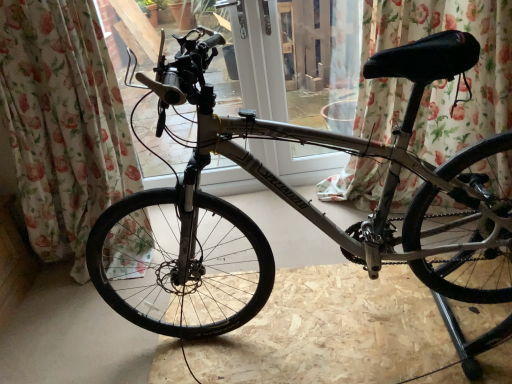
Describe the element at coordinates (456, 77) in the screenshot. I see `floral fabric curtain at upper center, which appears as the 1th curtain when viewed from the right` at that location.

Where is `floral fabric curtain at upper center, which appears as the 1th curtain when viewed from the right`? floral fabric curtain at upper center, which appears as the 1th curtain when viewed from the right is located at coordinates coord(456,77).

Locate an element on the screen. Image resolution: width=512 pixels, height=384 pixels. floral fabric curtain at upper center, which appears as the 1th curtain when viewed from the right is located at coordinates (456, 77).

Between silver metallic bicycle at center and floral fabric curtain at upper center, which appears as the 1th curtain when viewed from the right, which one is positioned in front?

silver metallic bicycle at center is closer to the camera.

Which is nearer, [432,181] or [372,202]?

Point [432,181] is closer to the camera than point [372,202].

Considering the relative sizes of silver metallic bicycle at center and floral fabric curtain at upper center, which appears as the 1th curtain when viewed from the right, in the image provided, is silver metallic bicycle at center taller than floral fabric curtain at upper center, which appears as the 1th curtain when viewed from the right,?

Yes.

Is silver metallic bicycle at center positioned with its back to floral fabric curtain at upper center, the 2th curtain in the left-to-right sequence?

No, silver metallic bicycle at center is not facing away from floral fabric curtain at upper center, the 2th curtain in the left-to-right sequence.

Does point (269, 281) appear closer or farther from the camera than point (94, 25)?

Point (269, 281) appears to be closer to the viewer than point (94, 25).

What's the angular difference between silver metallic bicycle at center and floral fabric curtain at left, positioned as the second curtain in right-to-left order,'s facing directions?

89.9 degrees.

Can floral fabric curtain at left, positioned as the second curtain in right-to-left order, be found inside silver metallic bicycle at center?

Actually, floral fabric curtain at left, positioned as the second curtain in right-to-left order, is outside silver metallic bicycle at center.

Looking at the image, does floral fabric curtain at upper center, the 2th curtain in the left-to-right sequence, seem bigger or smaller compared to floral fabric curtain at left, positioned as the second curtain in right-to-left order?

Considering their sizes, floral fabric curtain at upper center, the 2th curtain in the left-to-right sequence, takes up less space than floral fabric curtain at left, positioned as the second curtain in right-to-left order.

Considering the relative positions of floral fabric curtain at upper center, which appears as the 1th curtain when viewed from the right, and floral fabric curtain at left, positioned as the second curtain in right-to-left order, in the image provided, is floral fabric curtain at upper center, which appears as the 1th curtain when viewed from the right, to the left of floral fabric curtain at left, positioned as the second curtain in right-to-left order, from the viewer's perspective?

Incorrect, floral fabric curtain at upper center, which appears as the 1th curtain when viewed from the right, is not on the left side of floral fabric curtain at left, positioned as the second curtain in right-to-left order.

Is floral fabric curtain at upper center, which appears as the 1th curtain when viewed from the right, in front of or behind floral fabric curtain at left, positioned as the second curtain in right-to-left order, in the image?

floral fabric curtain at upper center, which appears as the 1th curtain when viewed from the right, is behind floral fabric curtain at left, positioned as the second curtain in right-to-left order.

Is floral fabric curtain at upper center, the 2th curtain in the left-to-right sequence, with floral fabric curtain at left, positioned as the second curtain in right-to-left order?

No, floral fabric curtain at upper center, the 2th curtain in the left-to-right sequence, is not beside floral fabric curtain at left, positioned as the second curtain in right-to-left order.

Between floral fabric curtain at left, the first curtain viewed from the left, and silver metallic bicycle at center, which one has larger size?

silver metallic bicycle at center.

Is silver metallic bicycle at center completely or partially inside floral fabric curtain at left, the first curtain viewed from the left?

No, silver metallic bicycle at center is located outside of floral fabric curtain at left, the first curtain viewed from the left.

Is floral fabric curtain at left, the first curtain viewed from the left, facing towards silver metallic bicycle at center?

No, floral fabric curtain at left, the first curtain viewed from the left, is not oriented towards silver metallic bicycle at center.

Is floral fabric curtain at upper center, the 2th curtain in the left-to-right sequence, bigger than silver metallic bicycle at center?

Actually, floral fabric curtain at upper center, the 2th curtain in the left-to-right sequence, might be smaller than silver metallic bicycle at center.

Can you tell me how much floral fabric curtain at upper center, the 2th curtain in the left-to-right sequence, and silver metallic bicycle at center differ in facing direction?

The facing directions of floral fabric curtain at upper center, the 2th curtain in the left-to-right sequence, and silver metallic bicycle at center are 88.7 degrees apart.

Which object is thinner, floral fabric curtain at upper center, which appears as the 1th curtain when viewed from the right, or silver metallic bicycle at center?

floral fabric curtain at upper center, which appears as the 1th curtain when viewed from the right, is thinner.

Is floral fabric curtain at upper center, which appears as the 1th curtain when viewed from the right, oriented towards silver metallic bicycle at center?

Yes, floral fabric curtain at upper center, which appears as the 1th curtain when viewed from the right, is turned towards silver metallic bicycle at center.

Can you tell me how much floral fabric curtain at left, positioned as the second curtain in right-to-left order, and floral fabric curtain at upper center, the 2th curtain in the left-to-right sequence, differ in facing direction?

1.2 degrees separate the facing orientations of floral fabric curtain at left, positioned as the second curtain in right-to-left order, and floral fabric curtain at upper center, the 2th curtain in the left-to-right sequence.

Considering the sizes of objects floral fabric curtain at left, positioned as the second curtain in right-to-left order, and floral fabric curtain at upper center, the 2th curtain in the left-to-right sequence, in the image provided, who is thinner, floral fabric curtain at left, positioned as the second curtain in right-to-left order, or floral fabric curtain at upper center, the 2th curtain in the left-to-right sequence,?

With smaller width is floral fabric curtain at upper center, the 2th curtain in the left-to-right sequence.

From a real-world perspective, is floral fabric curtain at left, positioned as the second curtain in right-to-left order, over floral fabric curtain at upper center, the 2th curtain in the left-to-right sequence?

Yes, from a real-world perspective, floral fabric curtain at left, positioned as the second curtain in right-to-left order, is on top of floral fabric curtain at upper center, the 2th curtain in the left-to-right sequence.

Considering the sizes of floral fabric curtain at left, positioned as the second curtain in right-to-left order, and floral fabric curtain at upper center, which appears as the 1th curtain when viewed from the right, in the image, is floral fabric curtain at left, positioned as the second curtain in right-to-left order, taller or shorter than floral fabric curtain at upper center, which appears as the 1th curtain when viewed from the right,?

In the image, floral fabric curtain at left, positioned as the second curtain in right-to-left order, appears to be taller than floral fabric curtain at upper center, which appears as the 1th curtain when viewed from the right.

Image resolution: width=512 pixels, height=384 pixels. I want to click on bicycle below the floral fabric curtain at upper center, which appears as the 1th curtain when viewed from the right (from a real-world perspective), so (x=298, y=208).

What are the coordinates of `bicycle on the right of floral fabric curtain at left, the first curtain viewed from the left` in the screenshot? It's located at (298, 208).

Based on their spatial positions, is floral fabric curtain at upper center, the 2th curtain in the left-to-right sequence, or silver metallic bicycle at center further from floral fabric curtain at left, positioned as the second curtain in right-to-left order?

floral fabric curtain at upper center, the 2th curtain in the left-to-right sequence, is positioned further to the anchor floral fabric curtain at left, positioned as the second curtain in right-to-left order.

When comparing their distances from floral fabric curtain at left, positioned as the second curtain in right-to-left order, does silver metallic bicycle at center or floral fabric curtain at upper center, the 2th curtain in the left-to-right sequence, seem closer?

silver metallic bicycle at center is positioned closer to the anchor floral fabric curtain at left, positioned as the second curtain in right-to-left order.

Looking at the image, which one is located further to floral fabric curtain at upper center, the 2th curtain in the left-to-right sequence, floral fabric curtain at left, the first curtain viewed from the left, or silver metallic bicycle at center?

The object further to floral fabric curtain at upper center, the 2th curtain in the left-to-right sequence, is floral fabric curtain at left, the first curtain viewed from the left.

Based on the photo, based on their spatial positions, is silver metallic bicycle at center or floral fabric curtain at left, the first curtain viewed from the left, closer to floral fabric curtain at upper center, the 2th curtain in the left-to-right sequence?

Among the two, silver metallic bicycle at center is located nearer to floral fabric curtain at upper center, the 2th curtain in the left-to-right sequence.

Based on their spatial positions, is floral fabric curtain at left, the first curtain viewed from the left, or floral fabric curtain at upper center, the 2th curtain in the left-to-right sequence, further from silver metallic bicycle at center?

floral fabric curtain at upper center, the 2th curtain in the left-to-right sequence.

Based on their spatial positions, is floral fabric curtain at upper center, which appears as the 1th curtain when viewed from the right, or floral fabric curtain at left, positioned as the second curtain in right-to-left order, further from silver metallic bicycle at center?

floral fabric curtain at upper center, which appears as the 1th curtain when viewed from the right, is further to silver metallic bicycle at center.

Locate an element on the screen. bicycle located between floral fabric curtain at left, positioned as the second curtain in right-to-left order, and floral fabric curtain at upper center, which appears as the 1th curtain when viewed from the right, in the left-right direction is located at coordinates (298, 208).